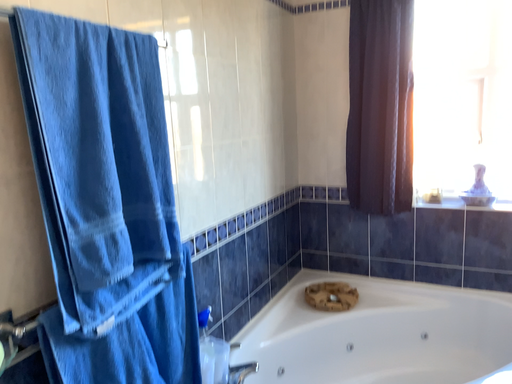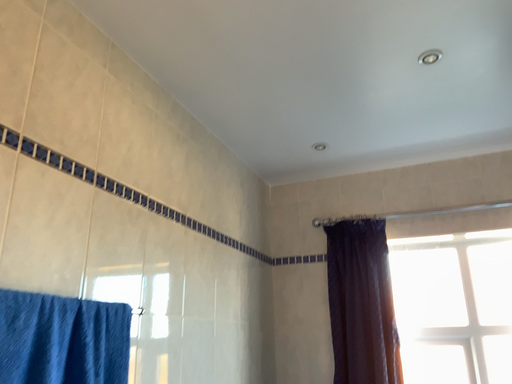
Question: How did the camera likely rotate when shooting the video?

Choices:
 (A) rotated downward
 (B) rotated upward

Answer: (B)